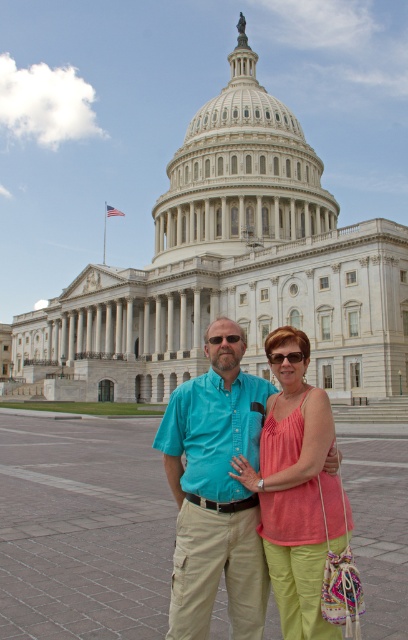
You are a photographer trying to capture a clear shot of the matte pink tank top at center and the matte black sunglasses at center in front of the Capitol building. Which object should you focus on first to ensure both are in focus?

The matte pink tank top at center is in front of the matte black sunglasses at center, so focusing on the matte pink tank top at center first will ensure both are in focus.